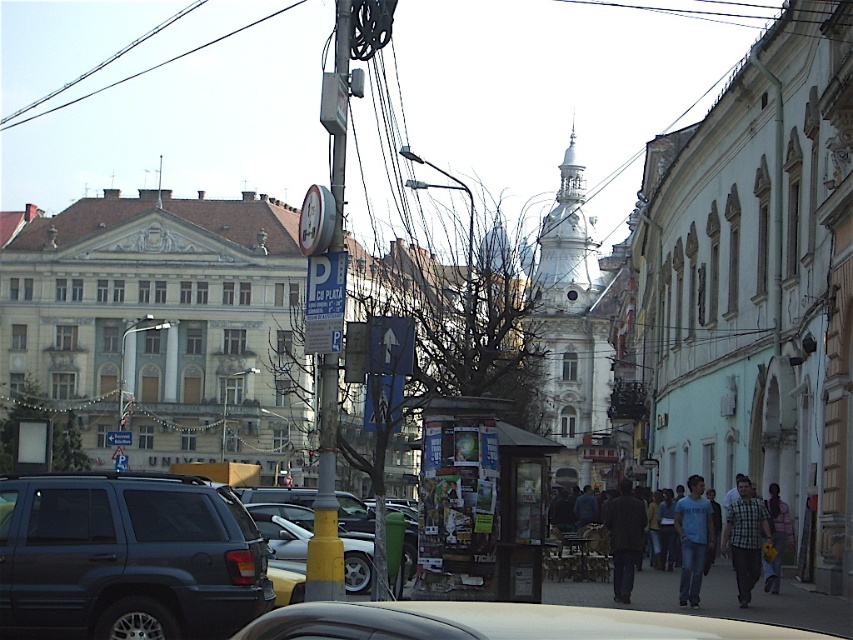
Between yellow painted metal pole at center and dark brown leather jacket at lower center, which one is positioned lower?

dark brown leather jacket at lower center

I want to click on yellow painted metal pole at center, so click(326, 497).

Locate an element on the screen. yellow painted metal pole at center is located at coordinates (326, 497).

Find the location of `matte black suv at lower left`. matte black suv at lower left is located at coordinates (126, 557).

From the picture: Can you confirm if matte black suv at lower left is taller than checkered fabric shirt at center?

No.

Is point (173, 557) farther from camera compared to point (743, 570)?

That is False.

The image size is (853, 640). I want to click on matte black suv at lower left, so click(x=126, y=557).

Can you confirm if matte black car at center is positioned above dark brown leather jacket at lower center?

Yes.

Where is `matte black car at center`? matte black car at center is located at coordinates (498, 621).

Locate an element on the screen. Image resolution: width=853 pixels, height=640 pixels. matte black car at center is located at coordinates (498, 621).